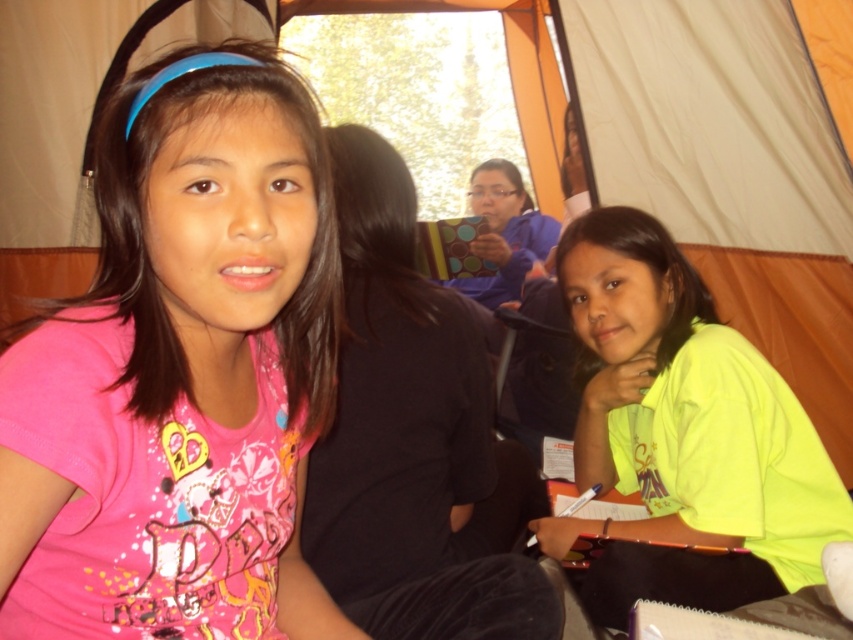
You are a photographer standing 50 inches away from the two girls in the tent. You want to take a photo of both the pink fabric shirt at center and the neon yellow shirt at right without moving the girls. Can you position yourself so that both shirts are in the frame?

The pink fabric shirt at center is 31.38 inches away from the neon yellow shirt at right. Since you are 50 inches away from both girls, the distance between the shirts is less than your distance from them, so both shirts will be within the camera frame.

You are a photographer setting up a shot of the two girls in the tent. You want to frame the girl in the pink fabric shirt at center so she is on the left side of the photo. Is the neon yellow shirt at right positioned correctly to the right of her?

Yes, the pink fabric shirt at center is to the left of neon yellow shirt at right, so the neon yellow shirt at right is positioned correctly to the right of the pink fabric shirt at center.